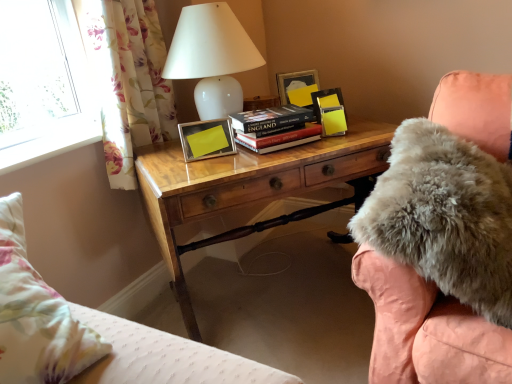
Question: Does wooden desk at center turn towards fuzzy pink chair at right?

Choices:
 (A) no
 (B) yes

Answer: (B)

Question: Can you confirm if wooden desk at center is bigger than fuzzy pink chair at right?

Choices:
 (A) yes
 (B) no

Answer: (A)

Question: Considering the relative sizes of wooden desk at center and fuzzy pink chair at right in the image provided, is wooden desk at center wider than fuzzy pink chair at right?

Choices:
 (A) yes
 (B) no

Answer: (B)

Question: From a real-world perspective, is wooden desk at center below fuzzy pink chair at right?

Choices:
 (A) yes
 (B) no

Answer: (A)

Question: From a real-world perspective, is wooden desk at center over fuzzy pink chair at right?

Choices:
 (A) no
 (B) yes

Answer: (A)

Question: Is wooden desk at center shorter than fuzzy pink chair at right?

Choices:
 (A) no
 (B) yes

Answer: (A)

Question: Does metallic silver picture frame at center, the 2th picture frame in the back-to-front sequence, have a lesser width compared to white glossy table lamp at upper center?

Choices:
 (A) yes
 (B) no

Answer: (A)

Question: Considering the relative sizes of metallic silver picture frame at center, marked as the second picture frame in a top-to-bottom arrangement, and white glossy table lamp at upper center in the image provided, is metallic silver picture frame at center, marked as the second picture frame in a top-to-bottom arrangement, wider than white glossy table lamp at upper center?

Choices:
 (A) yes
 (B) no

Answer: (B)

Question: Would you say metallic silver picture frame at center, the 2th picture frame in the back-to-front sequence, contains white glossy table lamp at upper center?

Choices:
 (A) no
 (B) yes

Answer: (A)

Question: From the image's perspective, is metallic silver picture frame at center, marked as the second picture frame in a top-to-bottom arrangement, over white glossy table lamp at upper center?

Choices:
 (A) no
 (B) yes

Answer: (A)

Question: Can you confirm if metallic silver picture frame at center, which is the 1th picture frame in bottom-to-top order, is positioned to the right of white glossy table lamp at upper center?

Choices:
 (A) no
 (B) yes

Answer: (A)

Question: From the image's perspective, is metallic silver picture frame at center, which is the 2th picture frame from right to left, beneath white glossy table lamp at upper center?

Choices:
 (A) yes
 (B) no

Answer: (A)

Question: Are yellow matte picture frame at upper right, the first picture frame when ordered from back to front, and wooden desk at center beside each other?

Choices:
 (A) no
 (B) yes

Answer: (A)